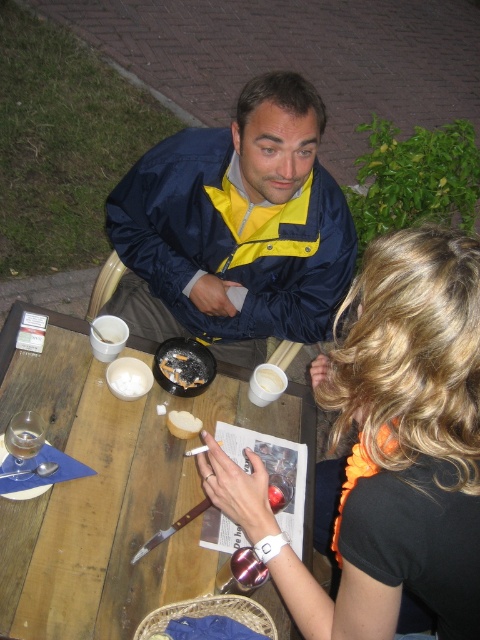
Question: Which point is closer to the camera?

Choices:
 (A) (158, 141)
 (B) (197, 358)

Answer: (B)

Question: Can you confirm if white matte bread at upper center is bigger than white matte bread at center?

Choices:
 (A) yes
 (B) no

Answer: (A)

Question: Is navy blue jacket at upper center thinner than white matte bread at center?

Choices:
 (A) no
 (B) yes

Answer: (A)

Question: Can you confirm if wooden table at center is bigger than crumbly brown bread at table center?

Choices:
 (A) yes
 (B) no

Answer: (A)

Question: Which point appears farthest from the camera in this image?

Choices:
 (A) (222, 506)
 (B) (75, 362)
 (C) (160, 371)
 (D) (176, 426)

Answer: (B)

Question: Based on their relative distances, which object is nearer to the black fabric shirt at upper right?

Choices:
 (A) crumbly brown bread at table center
 (B) white matte bread at upper center

Answer: (A)